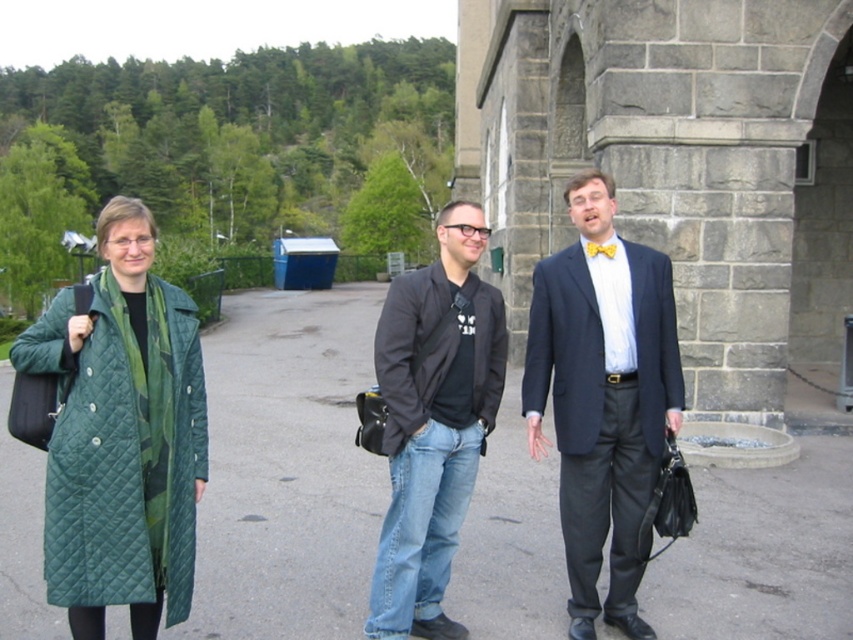
You are a photographer setting up for an outdoor event. You notice two items at the center of the scene, the matte black suit at center and the yellow satin bow tie at center. Based on their positions, which one should you focus on first if you want to capture the subject from head to toe?

The yellow satin bow tie at center is above the matte black suit at center, so you should focus on the yellow satin bow tie at center first when capturing from head to toe.

You are a photographer standing in front of the stone building with arched features. You want to take a group photo of the black cotton jacket at center and the black quilted jacket at center. If your camera has a depth of field that can focus on objects within 18 inches of each other, will both jackets be in focus?

The black cotton jacket at center is 19.44 inches away from the black quilted jacket at center. Since the distance between them exceeds the camera s 18 inches depth of field range, the two jackets might not both be in focus simultaneously.